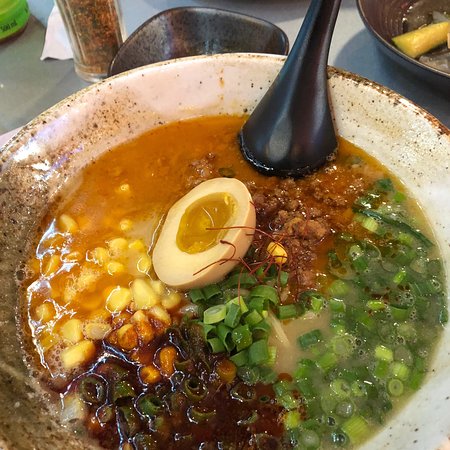
The image size is (450, 450). What are the coordinates of `seasoning blend in shaker` in the screenshot? It's located at [x=95, y=33].